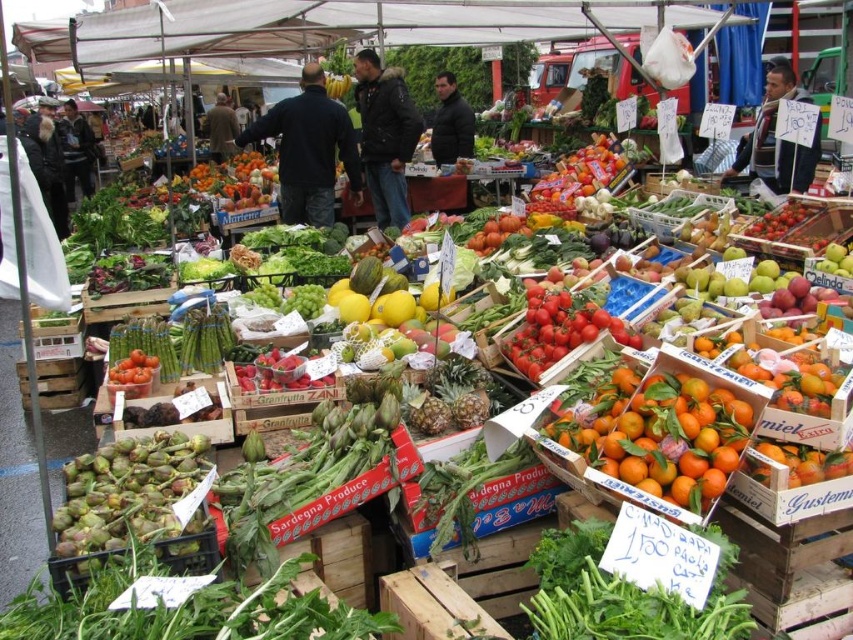
You are a customer at the market who wants to buy both the green matte artichoke at lower left and the ripe red tomato at center. If your basket can only hold items within a 15 feet radius, will you be able to carry both without moving your basket?

The green matte artichoke at lower left and the ripe red tomato at center are 15.70 feet apart from each other. Since the distance exceeds the 15 feet radius, you cannot carry both without moving your basket.

You are a customer at the market and want to buy the green leafy at center. The market has a rule that items located at coordinates between 0.7 and 0.9 on the x and y axes are considered premium items and cost 20 percent more. Are you going to pay extra for this item?

The green leafy at center is located at coordinates point (624, 595). Since both coordinates are between 0.7 and 0.9, it falls within the premium zone, so you will have to pay 20 percent extra.

You are a customer at the market and want to buy both the green matte artichoke at lower left and the yellow matte melon at center. If you have a small basket that can only hold one of them, which one should you choose based on their size?

The green matte artichoke at lower left is smaller than the yellow matte melon at center, so you should choose the green matte artichoke at lower left to fit in your small basket.